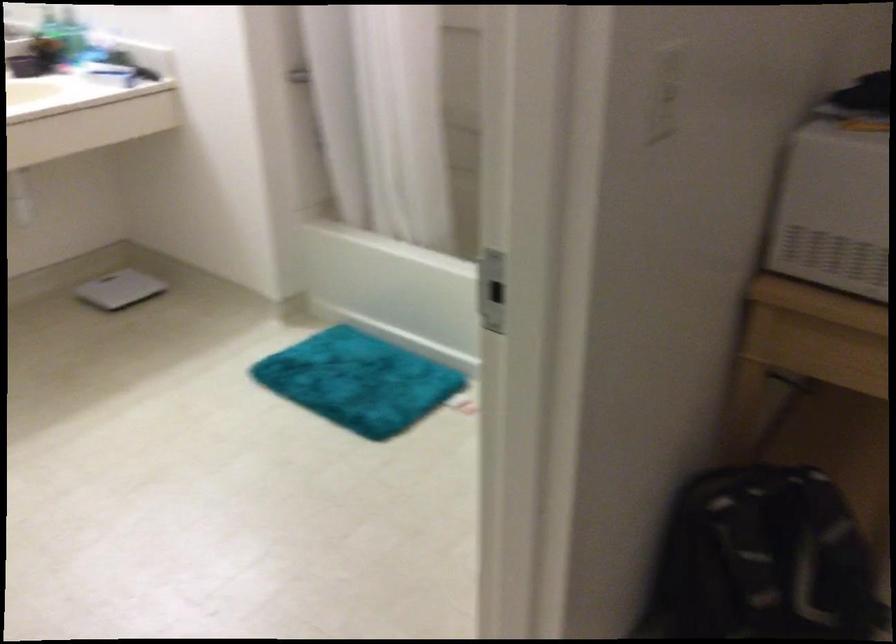
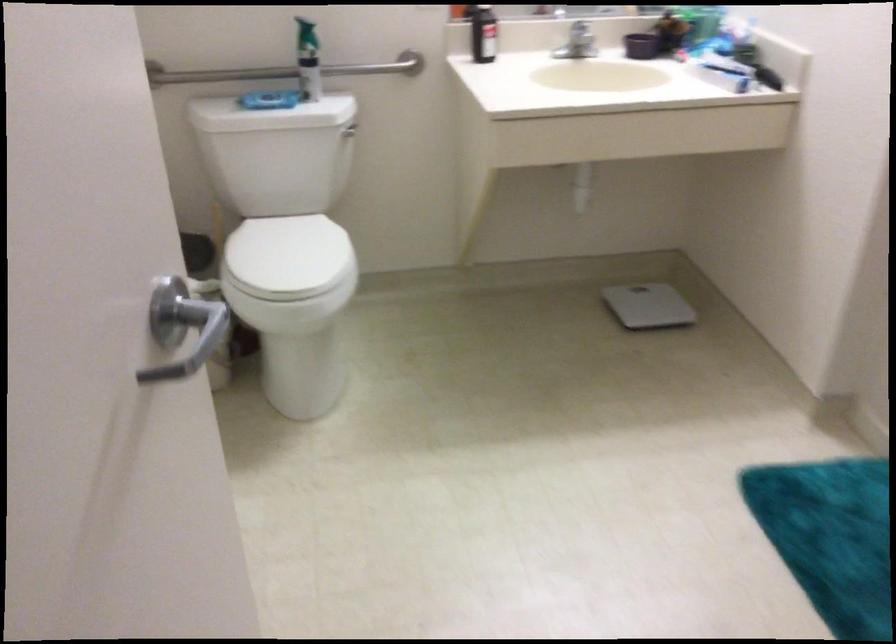
Question: The camera is either moving clockwise (left) or counter-clockwise (right) around the object. The first image is from the beginning of the video and the second image is from the end. Is the camera moving left or right when shooting the video?

Choices:
 (A) Left
 (B) Right

Answer: (B)